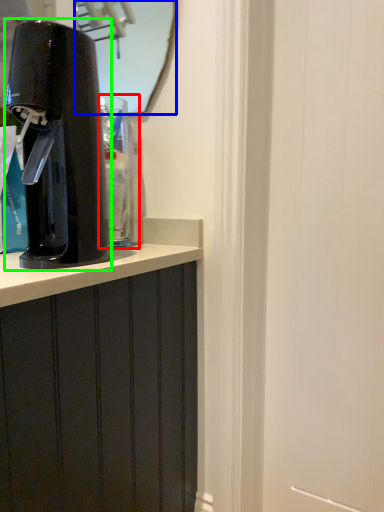
Question: Considering the real-world distances, which object is closest to water cooler (highlighted by a red box)? mirror (highlighted by a blue box) or home appliance (highlighted by a green box).

Choices:
 (A) mirror
 (B) home appliance

Answer: (B)